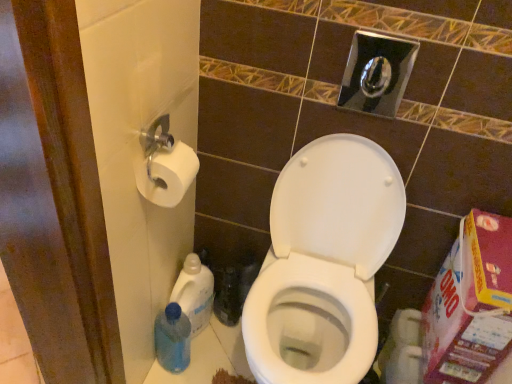
Question: From a real-world perspective, is white matte toilet paper at left located higher than white glossy toilet at center?

Choices:
 (A) yes
 (B) no

Answer: (A)

Question: Is white matte toilet paper at left oriented towards white glossy toilet at center?

Choices:
 (A) no
 (B) yes

Answer: (B)

Question: Does white matte toilet paper at left have a greater height compared to white glossy toilet at center?

Choices:
 (A) yes
 (B) no

Answer: (B)

Question: Is white matte toilet paper at left at the left side of white glossy toilet at center?

Choices:
 (A) no
 (B) yes

Answer: (B)

Question: Does white matte toilet paper at left have a lesser width compared to white glossy toilet at center?

Choices:
 (A) no
 (B) yes

Answer: (B)

Question: Does point [167, 357] appear closer or farther from the camera than point [244, 334]?

Choices:
 (A) farther
 (B) closer

Answer: (A)

Question: From a real-world perspective, is blue plastic bottle at lower left, acting as the 1th cleaning product starting from the bottom, physically located above or below white glossy toilet at center?

Choices:
 (A) below
 (B) above

Answer: (A)

Question: From the image's perspective, relative to white glossy toilet at center, is blue plastic bottle at lower left, acting as the 1th cleaning product starting from the bottom, above or below?

Choices:
 (A) above
 (B) below

Answer: (B)

Question: Considering their positions, is blue plastic bottle at lower left, which ranks as the 2th cleaning product in top-to-bottom order, located in front of or behind white glossy toilet at center?

Choices:
 (A) behind
 (B) front

Answer: (A)

Question: From the image's perspective, is white glossy toilet at center above or below blue plastic bottle at lower left, which ranks as the 2th cleaning product in top-to-bottom order?

Choices:
 (A) below
 (B) above

Answer: (B)

Question: Does point (326, 251) appear closer or farther from the camera than point (166, 326)?

Choices:
 (A) closer
 (B) farther

Answer: (B)

Question: Based on their sizes in the image, would you say white glossy toilet at center is bigger or smaller than blue plastic bottle at lower left, which ranks as the 2th cleaning product in top-to-bottom order?

Choices:
 (A) big
 (B) small

Answer: (A)

Question: In the image, is white glossy toilet at center on the left side or the right side of blue plastic bottle at lower left, acting as the 1th cleaning product starting from the bottom?

Choices:
 (A) right
 (B) left

Answer: (A)

Question: Is white glossy toilet at center taller or shorter than white matte toilet paper at left?

Choices:
 (A) tall
 (B) short

Answer: (A)

Question: From a real-world perspective, is white glossy toilet at center positioned above or below white matte toilet paper at left?

Choices:
 (A) below
 (B) above

Answer: (A)